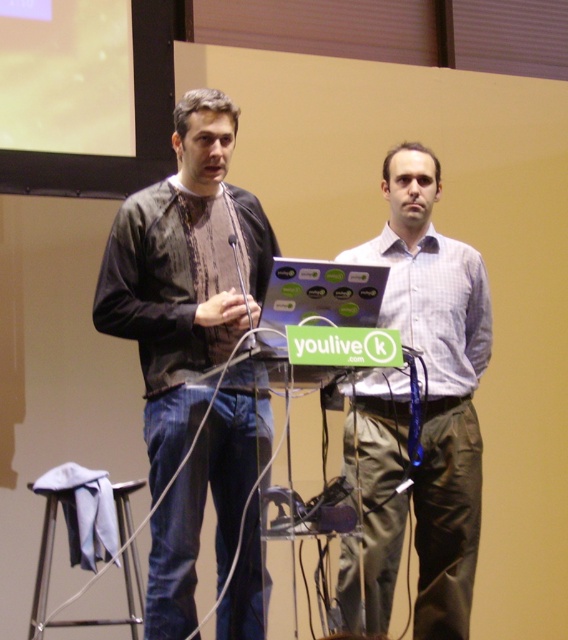
Question: Where is dark brown leather jacket at left located in relation to matte plastic laptop at center in the image?

Choices:
 (A) left
 (B) right

Answer: (A)

Question: Among these points, which one is nearest to the camera?

Choices:
 (A) (214, 216)
 (B) (286, 323)

Answer: (B)

Question: Which object is farther from the camera taking this photo?

Choices:
 (A) dark brown leather jacket at left
 (B) white checkered shirt at center
 (C) matte plastic laptop at center

Answer: (B)

Question: Which point is farther from the camera taking this photo?

Choices:
 (A) (77, 150)
 (B) (36, 570)
 (C) (360, 292)
 (D) (457, 372)

Answer: (A)

Question: Does yellow matte projection screen at upper left appear on the left side of matte plastic laptop at center?

Choices:
 (A) no
 (B) yes

Answer: (B)

Question: Is yellow matte projection screen at upper left below matte plastic laptop at center?

Choices:
 (A) no
 (B) yes

Answer: (A)